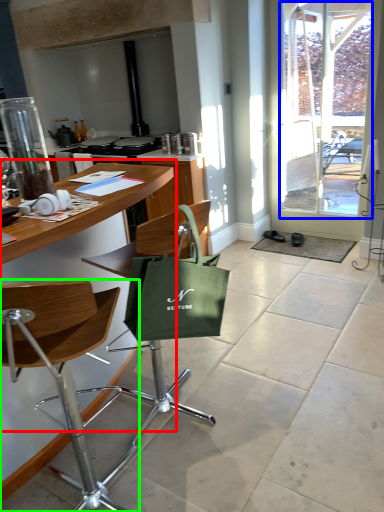
Question: Estimate the real-world distances between objects in this image. Which object is farther from table (highlighted by a red box), window screen (highlighted by a blue box) or chair (highlighted by a green box)?

Choices:
 (A) window screen
 (B) chair

Answer: (A)